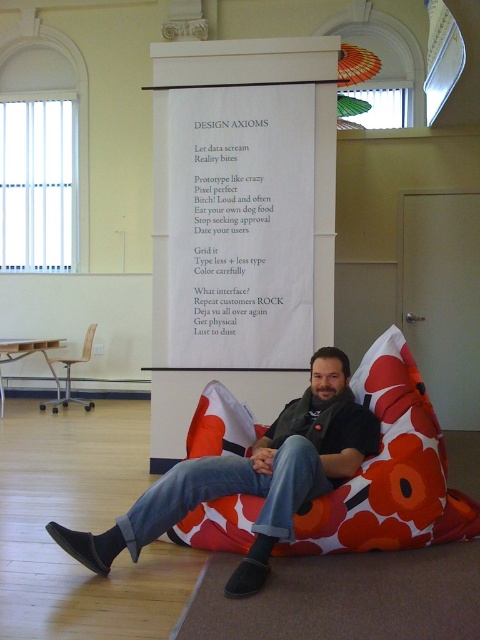
You are a conference attendee who wants to approach the podium behind the floral fabric bean bag at center. Based on its position, can you estimate whether you can walk around the bean bag to reach the podium without moving it?

The floral fabric bean bag at center is positioned at point (391, 470), which is likely near the center of the image. Since bean bags are typically movable, you can move it aside to create a path to the podium behind it.

Looking at this image, you are a photographer setting up a shoot in this room. You want to position a spotlight so that it illuminates the denim jeans at center without casting a shadow from the floral fabric bean bag at center. Is this possible given their current positions?

The denim jeans at center is behind the floral fabric bean bag at center, so the bean bag would block the light from reaching the jeans. Therefore, it is not possible to illuminate the denim jeans at center without the bean bag casting a shadow on them.